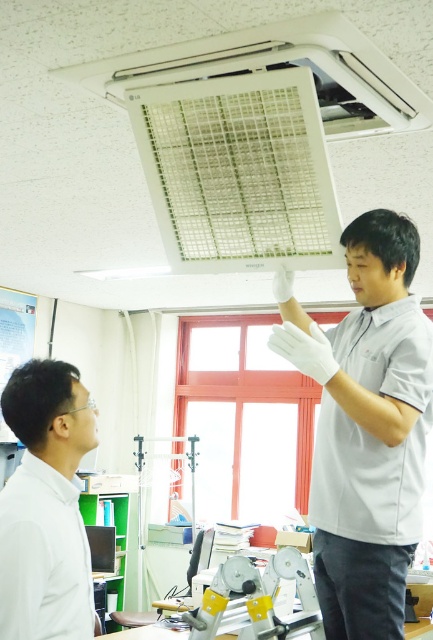
Is white matte gloves at upper center positioned behind white matte shirt at upper left?

Yes, it is behind white matte shirt at upper left.

Who is positioned more to the right, white matte gloves at upper center or white matte shirt at upper left?

white matte gloves at upper center

Which is behind, point (371, 428) or point (22, 620)?

Positioned behind is point (371, 428).

Find the location of `white matte gloves at upper center`. white matte gloves at upper center is located at coordinates (365, 428).

Does white matte shirt at upper left have a larger size compared to white plastic exhaust hood at upper center?

Incorrect, white matte shirt at upper left is not larger than white plastic exhaust hood at upper center.

Which is below, white matte shirt at upper left or white plastic exhaust hood at upper center?

white matte shirt at upper left

Which is in front, point (18, 522) or point (430, 113)?

Point (18, 522) is more forward.

Locate an element on the screen. Image resolution: width=433 pixels, height=640 pixels. white matte shirt at upper left is located at coordinates (45, 506).

Can you confirm if white matte gloves at upper center is smaller than white plastic exhaust hood at upper center?

Actually, white matte gloves at upper center might be larger than white plastic exhaust hood at upper center.

This screenshot has height=640, width=433. What do you see at coordinates (365, 428) in the screenshot? I see `white matte gloves at upper center` at bounding box center [365, 428].

Is point (371, 474) farther from viewer compared to point (115, 90)?

That is False.

You are a GUI agent. You are given a task and a screenshot of the screen. Output one action in this format:
    pyautogui.click(x=<x>, y=<y>)
    Task: Click on the white matte gloves at upper center
    Image resolution: width=433 pixels, height=640 pixels.
    Given the screenshot: What is the action you would take?
    pyautogui.click(x=365, y=428)